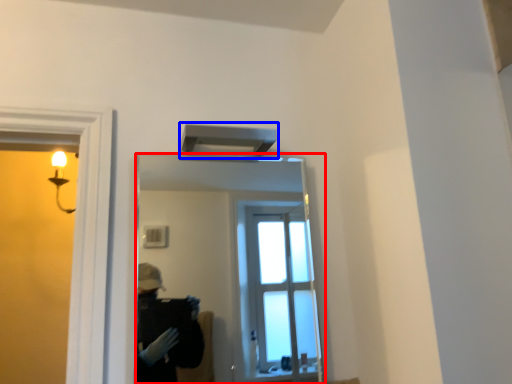
Question: Which of the following is the closest to the observer, mirror (highlighted by a red box) or exhaust hood (highlighted by a blue box)?

Choices:
 (A) mirror
 (B) exhaust hood

Answer: (A)